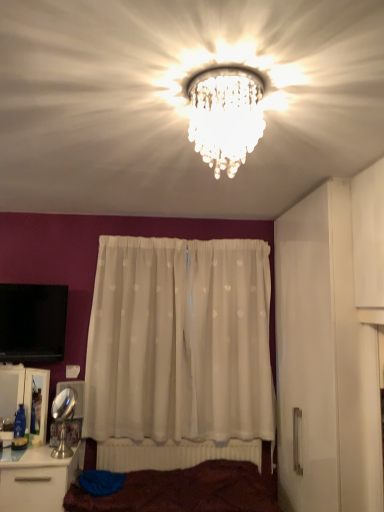
Describe the element at coordinates (185, 490) in the screenshot. I see `brown fabric bed at lower center` at that location.

The image size is (384, 512). Identify the location of clear crystal chandelier at center. (225, 115).

Find the location of a particular element. white sheer curtain at center is located at coordinates (180, 341).

The width and height of the screenshot is (384, 512). I want to click on brown fabric bed at lower center, so click(185, 490).

Is clear crystal chandelier at center with white plastic radiator at lower center?

No, clear crystal chandelier at center is not with white plastic radiator at lower center.

Does clear crystal chandelier at center come in front of white plastic radiator at lower center?

Yes, the depth of clear crystal chandelier at center is less than that of white plastic radiator at lower center.

In the scene shown: Considering the relative positions of clear crystal chandelier at center and white plastic radiator at lower center in the image provided, is clear crystal chandelier at center to the left of white plastic radiator at lower center from the viewer's perspective?

In fact, clear crystal chandelier at center is to the right of white plastic radiator at lower center.

Considering the relative sizes of clear crystal chandelier at center and white plastic radiator at lower center in the image provided, is clear crystal chandelier at center thinner than white plastic radiator at lower center?

In fact, clear crystal chandelier at center might be wider than white plastic radiator at lower center.

Which object is wider, brown fabric bed at lower center or black glossy television at left?

brown fabric bed at lower center is wider.

Is the surface of brown fabric bed at lower center in direct contact with black glossy television at left?

No, brown fabric bed at lower center is not next to black glossy television at left.

Is point (86, 493) farther from camera compared to point (41, 321)?

No, (86, 493) is in front of (41, 321).

From the image's perspective, is brown fabric bed at lower center below black glossy television at left?

Indeed, from the image's perspective, brown fabric bed at lower center is shown beneath black glossy television at left.

Can you confirm if white sheer curtain at center is positioned to the right of black glossy television at left?

Indeed, white sheer curtain at center is positioned on the right side of black glossy television at left.

Does white sheer curtain at center turn towards black glossy television at left?

No, white sheer curtain at center is not aimed at black glossy television at left.

From the picture: Is white sheer curtain at center further to camera compared to black glossy television at left?

Yes, the depth of white sheer curtain at center is greater than that of black glossy television at left.

Considering the sizes of objects white sheer curtain at center and black glossy television at left in the image provided, who is thinner, white sheer curtain at center or black glossy television at left?

With smaller width is black glossy television at left.

Which object is positioned more to the right, black glossy television at left or white sheer curtain at center?

white sheer curtain at center.

How different are the orientations of black glossy television at left and white sheer curtain at center in degrees?

They differ by 16.8 degrees in their facing directions.

Is black glossy television at left touching white sheer curtain at center?

No, black glossy television at left is not with white sheer curtain at center.

Where is `curtain on the right of the black glossy television at left`? curtain on the right of the black glossy television at left is located at coordinates (180, 341).

Is white glossy cabinet at lower left directly adjacent to white sheer curtain at center?

No, white glossy cabinet at lower left is not with white sheer curtain at center.

Based on their sizes in the image, would you say white glossy cabinet at lower left is bigger or smaller than white sheer curtain at center?

Considering their sizes, white glossy cabinet at lower left takes up less space than white sheer curtain at center.

Is white glossy cabinet at lower left inside or outside of white sheer curtain at center?

white glossy cabinet at lower left lies outside white sheer curtain at center.

Where is `curtain above the white glossy cabinet at lower left (from the image's perspective)`? The height and width of the screenshot is (512, 384). curtain above the white glossy cabinet at lower left (from the image's perspective) is located at coordinates (180, 341).

Is white plastic radiator at lower center a part of white glossy cabinet at lower left?

That's incorrect, white plastic radiator at lower center is not inside white glossy cabinet at lower left.

How different are the orientations of white glossy cabinet at lower left and white plastic radiator at lower center in degrees?

white glossy cabinet at lower left and white plastic radiator at lower center are facing 5.43 degrees away from each other.

Does white glossy cabinet at lower left appear on the right side of white plastic radiator at lower center?

Incorrect, white glossy cabinet at lower left is not on the right side of white plastic radiator at lower center.

Is white glossy cabinet at lower left touching white plastic radiator at lower center?

white glossy cabinet at lower left and white plastic radiator at lower center are not in contact.

Is white glossy cabinet at lower left taller or shorter than clear crystal chandelier at center?

Considering their sizes, white glossy cabinet at lower left has more height than clear crystal chandelier at center.

Is white glossy cabinet at lower left bigger or smaller than clear crystal chandelier at center?

Clearly, white glossy cabinet at lower left is larger in size than clear crystal chandelier at center.

From the image's perspective, between white glossy cabinet at lower left and clear crystal chandelier at center, which one is located above?

clear crystal chandelier at center.

At what (x,y) coordinates should I click in order to perform the action: click on radiator that is behind the clear crystal chandelier at center. Please return your answer as a coordinate pair (x, y). The height and width of the screenshot is (512, 384). Looking at the image, I should click on (172, 454).

Locate an element on the screen. The image size is (384, 512). television that appears on the left of brown fabric bed at lower center is located at coordinates (32, 322).

When comparing their distances from black glossy television at left, does white sheer curtain at center or clear crystal chandelier at center seem further?

clear crystal chandelier at center.

Based on their spatial positions, is brown fabric bed at lower center or white sheer curtain at center closer to white glossy cabinet at lower left?

white sheer curtain at center is closer to white glossy cabinet at lower left.

When comparing their distances from brown fabric bed at lower center, does black glossy television at left or clear crystal chandelier at center seem closer?

black glossy television at left is positioned closer to the anchor brown fabric bed at lower center.

Looking at the image, which one is located further to white glossy cabinet at lower left, black glossy television at left or clear crystal chandelier at center?

Among the two, clear crystal chandelier at center is located further to white glossy cabinet at lower left.

Which object lies further to the anchor point brown fabric bed at lower center, white plastic radiator at lower center or clear crystal chandelier at center?

clear crystal chandelier at center is positioned further to the anchor brown fabric bed at lower center.

Looking at the image, which one is located further to clear crystal chandelier at center, white glossy cabinet at lower left or white plastic radiator at lower center?

The object further to clear crystal chandelier at center is white plastic radiator at lower center.

Looking at the image, which one is located closer to clear crystal chandelier at center, white glossy cabinet at lower left or white sheer curtain at center?

Among the two, white sheer curtain at center is located nearer to clear crystal chandelier at center.

From the image, which object appears to be nearer to brown fabric bed at lower center, clear crystal chandelier at center or white plastic radiator at lower center?

white plastic radiator at lower center is closer to brown fabric bed at lower center.

Locate an element on the screen. cabinetry between clear crystal chandelier at center and brown fabric bed at lower center from top to bottom is located at coordinates (26, 396).

Locate an element on the screen. The width and height of the screenshot is (384, 512). curtain located between white glossy cabinet at lower left and white plastic radiator at lower center in the left-right direction is located at coordinates (180, 341).

Image resolution: width=384 pixels, height=512 pixels. Identify the location of bed frame between clear crystal chandelier at center and white plastic radiator at lower center in the vertical direction. (185, 490).

Identify the location of curtain between clear crystal chandelier at center and white plastic radiator at lower center in the front-back direction. This screenshot has height=512, width=384. (180, 341).